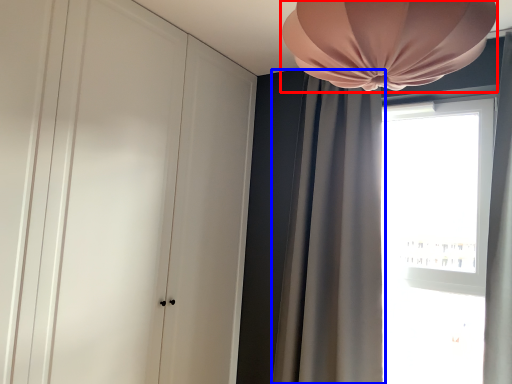
Question: Which of the following is the closest to the observer, lamp (highlighted by a red box) or curtain (highlighted by a blue box)?

Choices:
 (A) lamp
 (B) curtain

Answer: (A)